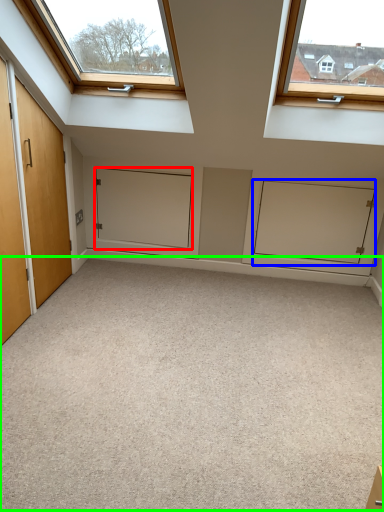
Question: Which object is positioned closest to door (highlighted by a red box)? Select from cabinetry (highlighted by a blue box) and plain (highlighted by a green box).

Choices:
 (A) cabinetry
 (B) plain

Answer: (A)